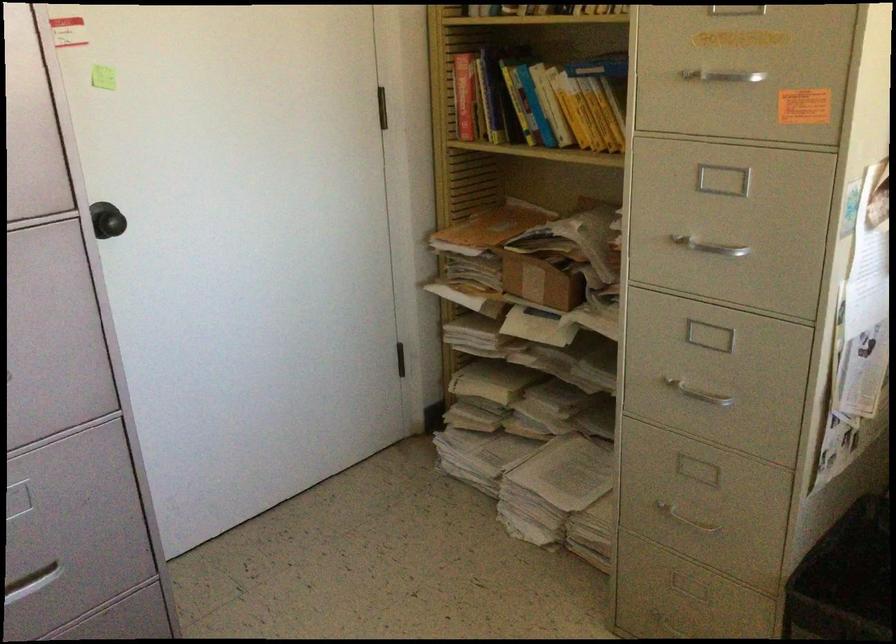
Where would you pull the red book? Please return your answer as a coordinate pair (x, y).

(464, 96)